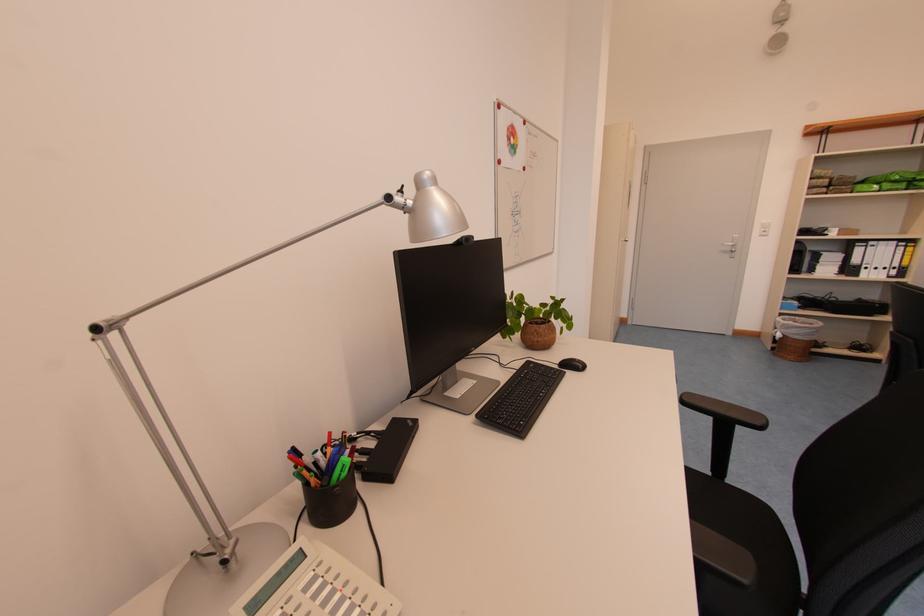
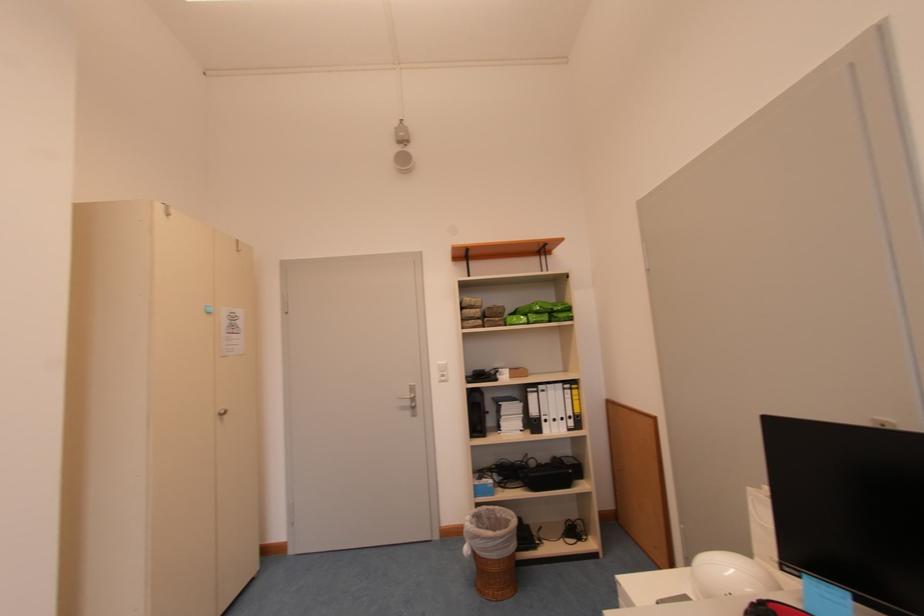
Where in the second image is the point corresponding to (865,246) from the first image?

(536, 392)